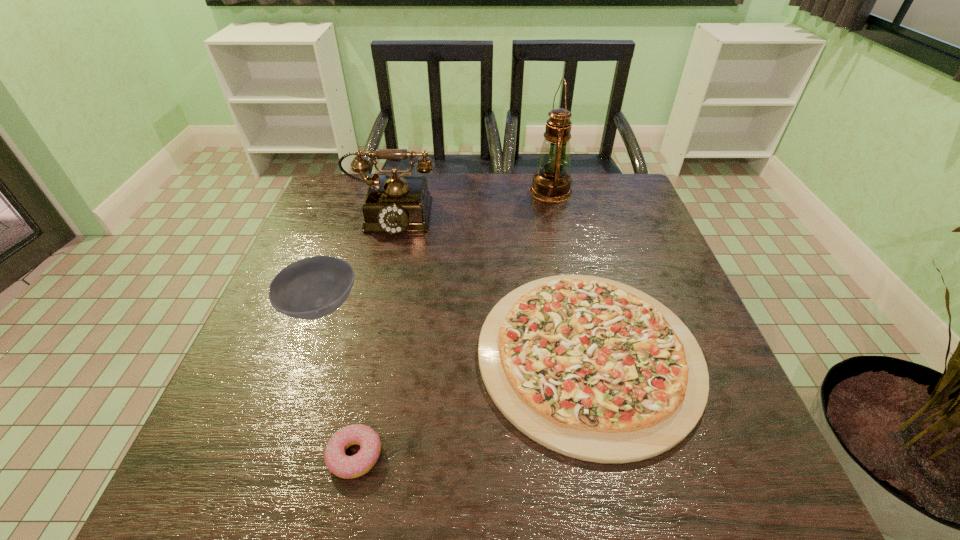
The image size is (960, 540). Identify the location of the tallest object. coord(551,183).

Where is `telephone`? telephone is located at coordinates (394, 203).

At what (x,y) coordinates should I click in order to perform the action: click on the third shortest object. Please return your answer as a coordinate pair (x, y). Looking at the image, I should click on (311, 288).

I want to click on pizza, so click(591, 368).

Image resolution: width=960 pixels, height=540 pixels. Identify the location of doughnut. (347, 467).

Identify the location of free space located 0.150m on the left of the tallest object. (479, 191).

The image size is (960, 540). Find the location of `vacant area situated on the dial of the fourth shortest object`. vacant area situated on the dial of the fourth shortest object is located at coordinates (359, 347).

Where is `blank space located 0.380m on the right of the bowl`? blank space located 0.380m on the right of the bowl is located at coordinates (532, 307).

I want to click on free location located 0.270m on the left of the pizza, so point(342,355).

At what (x,y) coordinates should I click in order to perform the action: click on vacant space located 0.110m on the right of the doughnut. Please return your answer as a coordinate pair (x, y). The height and width of the screenshot is (540, 960). Looking at the image, I should click on (448, 456).